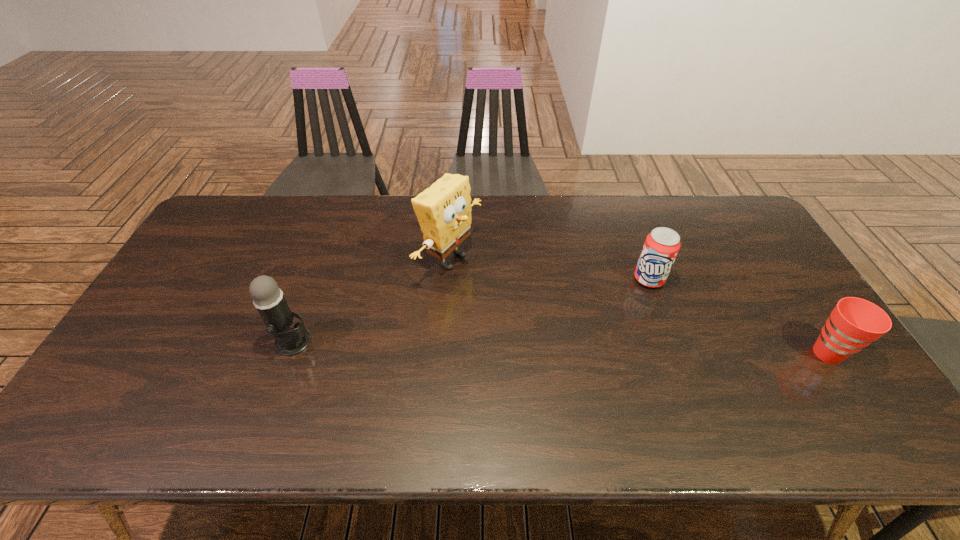
The image size is (960, 540). In order to click on the leftmost object in this screenshot , I will do [x=268, y=298].

Where is `cup`? The height and width of the screenshot is (540, 960). cup is located at coordinates (854, 323).

This screenshot has width=960, height=540. I want to click on sponge, so click(x=444, y=210).

Identify the location of the second object from right to left. (661, 246).

What are the coordinates of `vacant region located 0.050m on the right of the leftmost object` in the screenshot? It's located at (330, 342).

Locate an element on the screen. This screenshot has height=540, width=960. blank space located on the left of the cup is located at coordinates (709, 353).

Locate an element on the screen. vacant space situated 0.140m on the face of the third object from right to left is located at coordinates (516, 297).

Where is `vacant space situated on the face of the third object from right to left`? The height and width of the screenshot is (540, 960). vacant space situated on the face of the third object from right to left is located at coordinates (579, 328).

Locate an element on the screen. Image resolution: width=960 pixels, height=540 pixels. vacant space located 0.130m on the face of the third object from right to left is located at coordinates (513, 295).

Find the location of a particular element. The image size is (960, 540). vacant area situated on the surface of the second object from right to left is located at coordinates (609, 342).